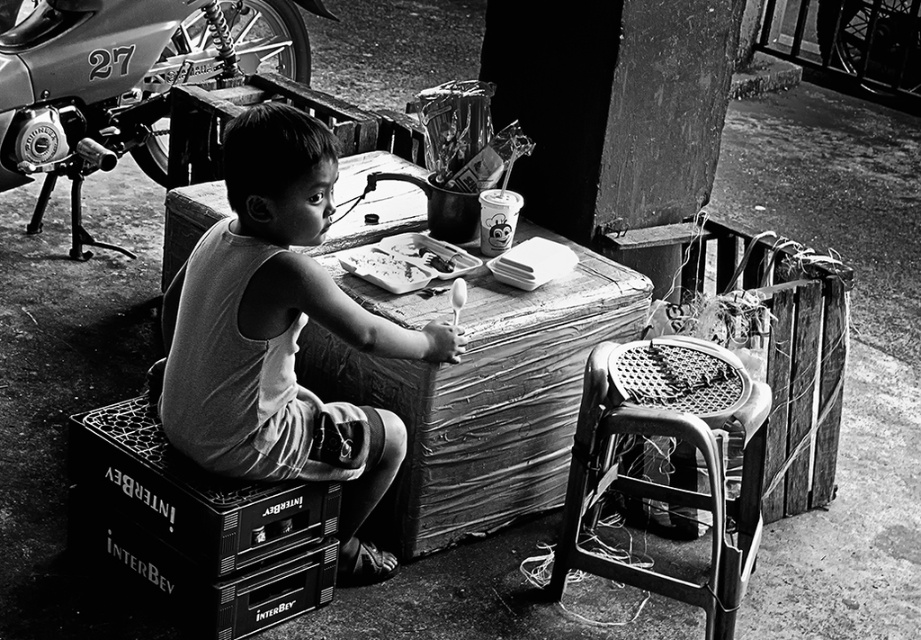
Question: Which point is closer to the camera taking this photo?

Choices:
 (A) (240, 339)
 (B) (302, 609)
 (C) (78, 128)
 (D) (710, 636)

Answer: (A)

Question: Can you confirm if metallic silver motorbike at left is bigger than black plastic box at lower left?

Choices:
 (A) no
 (B) yes

Answer: (B)

Question: Which object is positioned closest to the smooth cotton shirt at center?

Choices:
 (A) rusty metal stool at lower right
 (B) metallic silver motorbike at left
 (C) black plastic box at lower left

Answer: (C)

Question: Which of the following is the farthest from the observer?

Choices:
 (A) black plastic box at lower left
 (B) metallic silver motorbike at left
 (C) rusty metal stool at lower right
 (D) smooth cotton shirt at center

Answer: (B)

Question: Can you confirm if black plastic box at lower left is positioned below rusty metal stool at lower right?

Choices:
 (A) no
 (B) yes

Answer: (B)

Question: Is black plastic box at lower left to the right of rusty metal stool at lower right from the viewer's perspective?

Choices:
 (A) yes
 (B) no

Answer: (B)